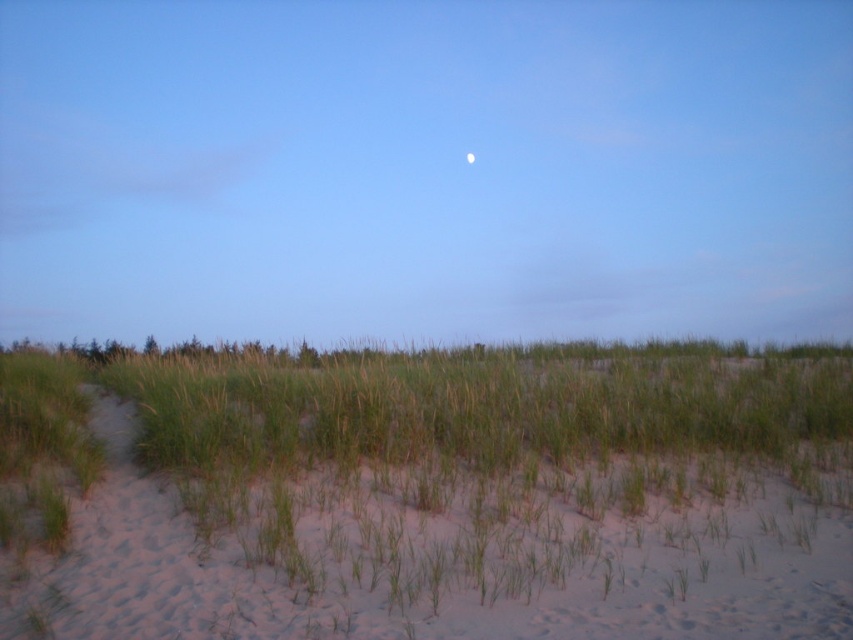
You are standing on the sand and want to touch both the green grass at center and the white glossy moon at upper center. Which one can you reach first?

The green grass at center is 19.36 meters away from the white glossy moon at upper center. Since the moon is in the sky and the grass is on the ground, you can reach the green grass at center first because it is closer to you than the moon.